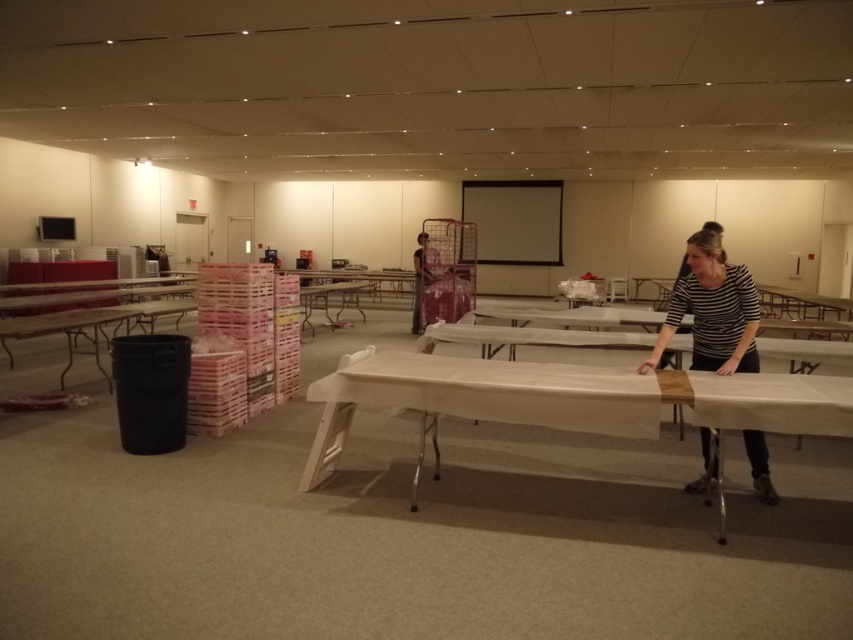
Question: Is white fabric-covered table at center to the right of matte black projection screen at center from the viewer's perspective?

Choices:
 (A) no
 (B) yes

Answer: (A)

Question: Estimate the real-world distances between objects in this image. Which object is closer to the patterned fabric dress at center?

Choices:
 (A) striped cotton shirt at right
 (B) matte black projection screen at center

Answer: (A)

Question: Which object is farther from the camera taking this photo?

Choices:
 (A) white plastic table at center
 (B) striped cotton shirt at right
 (C) matte white projection screen at upper center

Answer: (A)

Question: Does white fabric-covered table at center have a lesser width compared to white plastic table at center?

Choices:
 (A) no
 (B) yes

Answer: (A)

Question: Is the position of white fabric-covered table at center more distant than that of white plastic table at center?

Choices:
 (A) yes
 (B) no

Answer: (B)

Question: Considering the real-world distances, which object is farthest from the patterned fabric dress at center?

Choices:
 (A) white plastic table at center
 (B) white fabric-covered table at center
 (C) matte white projection screen at upper center

Answer: (C)